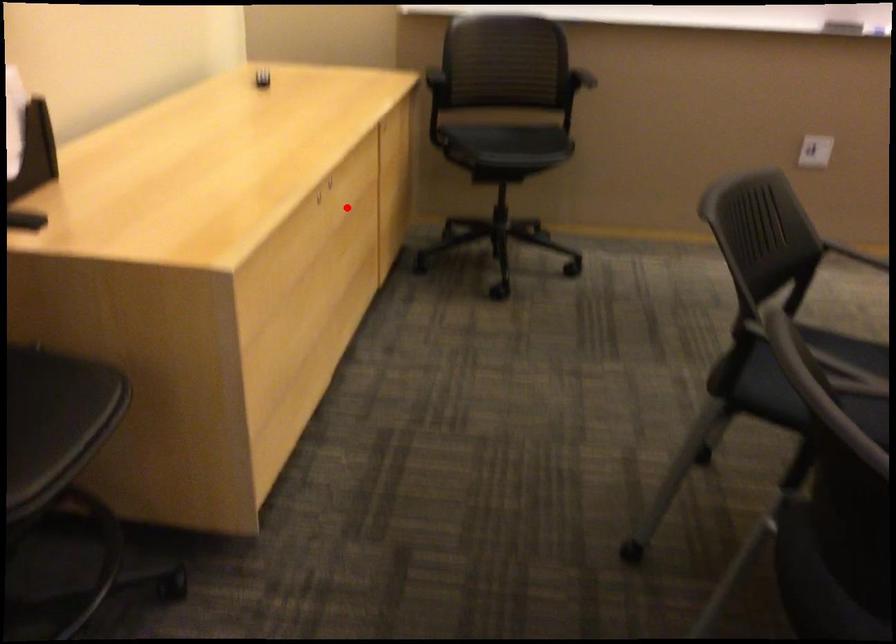
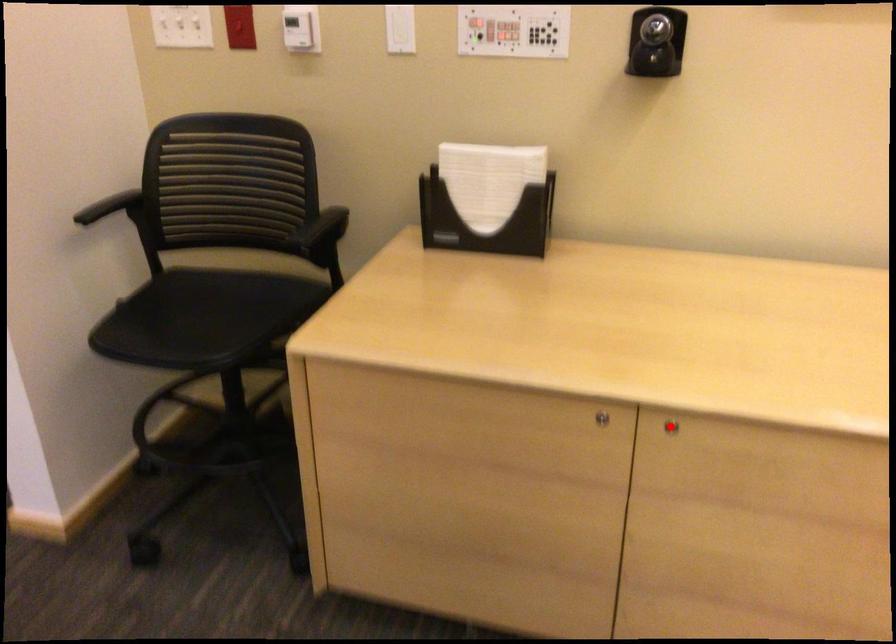
I am providing you with two images of the same scene from different viewpoints. A red point is marked on the first image and another point is marked on the second image. Does the point marked in image1 correspond to the same location as the one in image2?

Yes